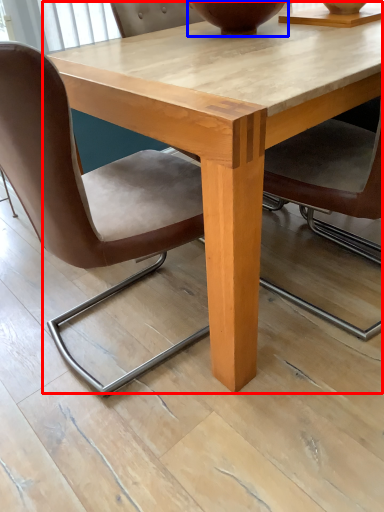
Question: Among these objects, which one is nearest to the camera, coffee table (highlighted by a red box) or vase (highlighted by a blue box)?

Choices:
 (A) coffee table
 (B) vase

Answer: (A)